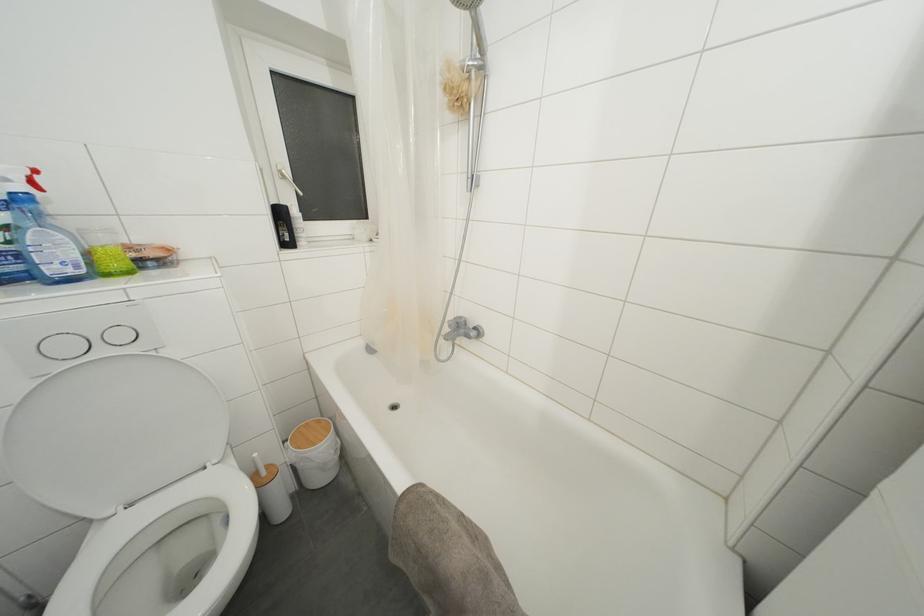
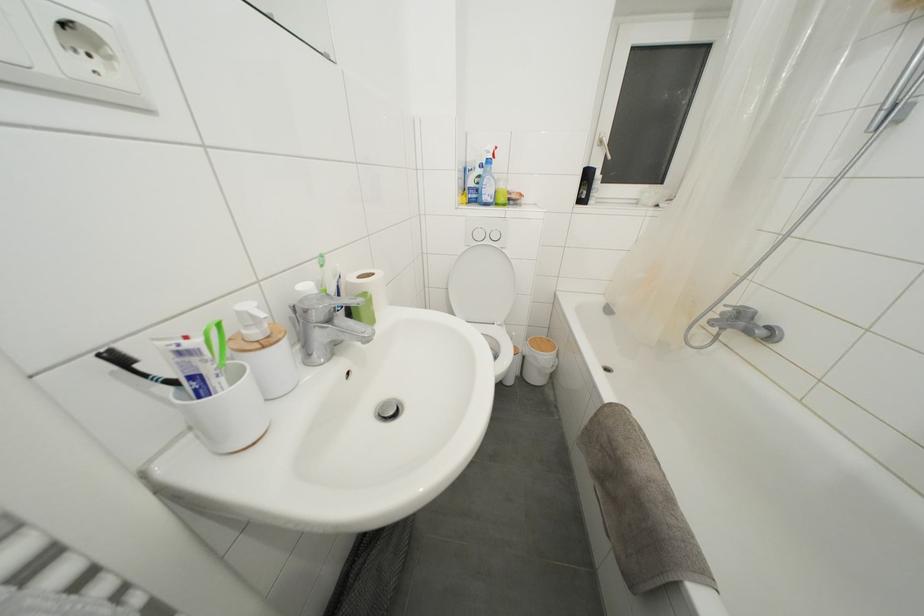
In the second image, find the point that corresponds to [285,219] in the first image.

(591, 180)